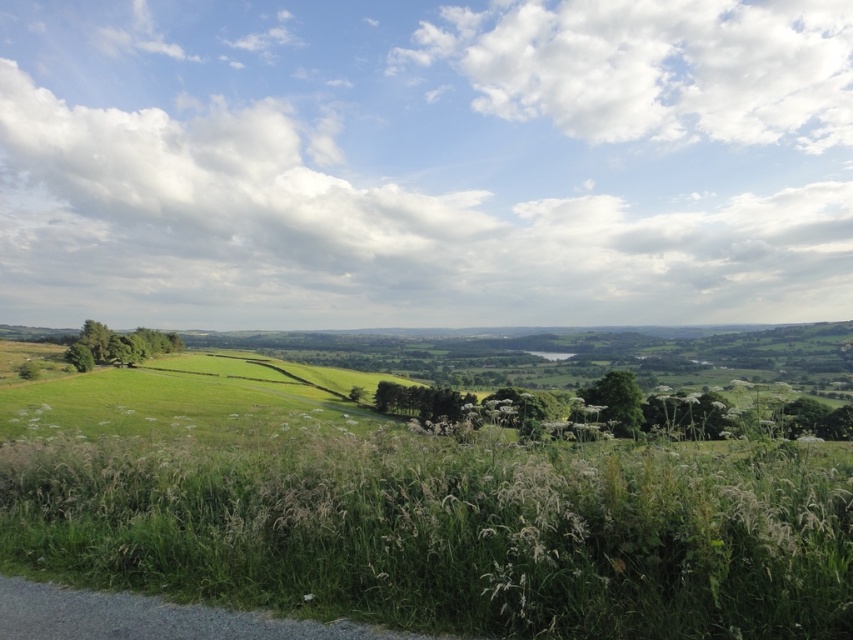
You are standing at the gravel path in the lower left corner and want to walk towards the green grassy at lower center. Which direction should you move relative to the green grassy field at lower left?

Since the green grassy at lower center is positioned on the right side of the green grassy field at lower left, you should move towards the right direction relative to the green grassy field at lower left to reach the green grassy at lower center.

You are standing at the gravel path at bottom left corner and want to walk towards the green grassy at lower center. Which direction should you move relative to the green grassy field at lower left?

To reach the green grassy at lower center from the gravel path at bottom left corner, you should move towards the upper direction since the green grassy at lower center is above the green grassy field at lower left.

You are standing at the edge of the scene and want to walk towards the green grassy at lower center and the green grassy field at lower left. Which area will you reach first?

The green grassy at lower center will be reached first because it is closer to the viewer than the green grassy field at lower left.